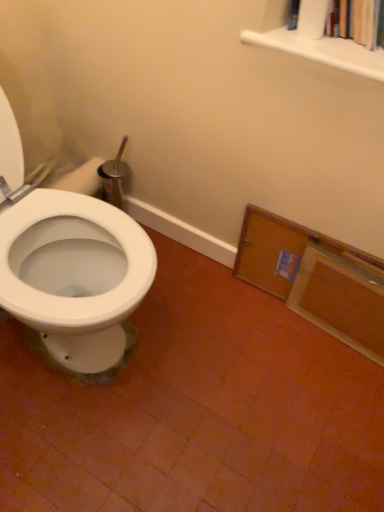
Question: Is wooden cabinet at lower right taller or shorter than white matte bookshelf at upper right?

Choices:
 (A) short
 (B) tall

Answer: (B)

Question: Looking at their shapes, would you say wooden cabinet at lower right is wider or thinner than white matte bookshelf at upper right?

Choices:
 (A) wide
 (B) thin

Answer: (B)

Question: Do you think wooden cabinet at lower right is within white matte bookshelf at upper right, or outside of it?

Choices:
 (A) outside
 (B) inside

Answer: (A)

Question: Does point (337, 46) appear closer or farther from the camera than point (377, 336)?

Choices:
 (A) closer
 (B) farther

Answer: (A)

Question: From a real-world perspective, is white matte bookshelf at upper right positioned above or below wooden cabinet at lower right?

Choices:
 (A) above
 (B) below

Answer: (A)

Question: In terms of width, does white matte bookshelf at upper right look wider or thinner when compared to wooden cabinet at lower right?

Choices:
 (A) wide
 (B) thin

Answer: (A)

Question: In terms of size, does white matte bookshelf at upper right appear bigger or smaller than wooden cabinet at lower right?

Choices:
 (A) big
 (B) small

Answer: (B)